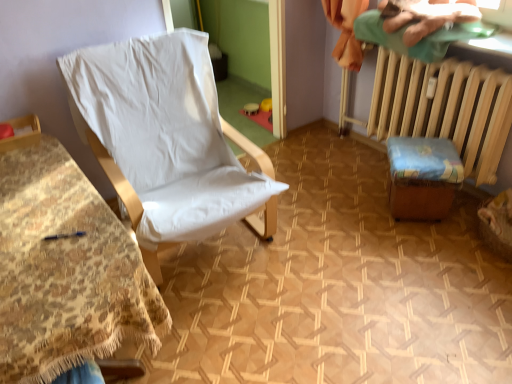
Question: Is wooden radiator at right looking in the opposite direction of wooden stool at lower right, marked as the first furniture in a right-to-left arrangement?

Choices:
 (A) no
 (B) yes

Answer: (B)

Question: Is wooden radiator at right placed right next to wooden stool at lower right, marked as the first furniture in a right-to-left arrangement?

Choices:
 (A) yes
 (B) no

Answer: (B)

Question: From a real-world perspective, is wooden radiator at right located higher than wooden stool at lower right, the second furniture when ordered from left to right?

Choices:
 (A) no
 (B) yes

Answer: (B)

Question: Considering the relative sizes of wooden radiator at right and wooden stool at lower right, the second furniture when ordered from left to right, in the image provided, is wooden radiator at right bigger than wooden stool at lower right, the second furniture when ordered from left to right,?

Choices:
 (A) no
 (B) yes

Answer: (B)

Question: Is wooden radiator at right taller than wooden stool at lower right, marked as the first furniture in a right-to-left arrangement?

Choices:
 (A) no
 (B) yes

Answer: (B)

Question: From the image's perspective, is wooden radiator at right below wooden stool at lower right, the second furniture when ordered from left to right?

Choices:
 (A) no
 (B) yes

Answer: (A)

Question: From the image's perspective, is green cotton cloth at upper right on wooden stool at lower right, marked as the first furniture in a right-to-left arrangement?

Choices:
 (A) yes
 (B) no

Answer: (A)

Question: Is green cotton cloth at upper right outside of wooden stool at lower right, the second furniture when ordered from left to right?

Choices:
 (A) yes
 (B) no

Answer: (A)

Question: Is green cotton cloth at upper right touching wooden stool at lower right, the second furniture when ordered from left to right?

Choices:
 (A) no
 (B) yes

Answer: (A)

Question: Is the depth of green cotton cloth at upper right greater than that of wooden stool at lower right, marked as the first furniture in a right-to-left arrangement?

Choices:
 (A) no
 (B) yes

Answer: (A)

Question: Is green cotton cloth at upper right oriented away from wooden stool at lower right, marked as the first furniture in a right-to-left arrangement?

Choices:
 (A) no
 (B) yes

Answer: (A)

Question: Can you confirm if green cotton cloth at upper right is positioned to the left of wooden stool at lower right, the second furniture when ordered from left to right?

Choices:
 (A) yes
 (B) no

Answer: (A)

Question: Is green cotton cloth at upper right oriented towards white fabric chair at left, the first furniture positioned from the left?

Choices:
 (A) yes
 (B) no

Answer: (B)